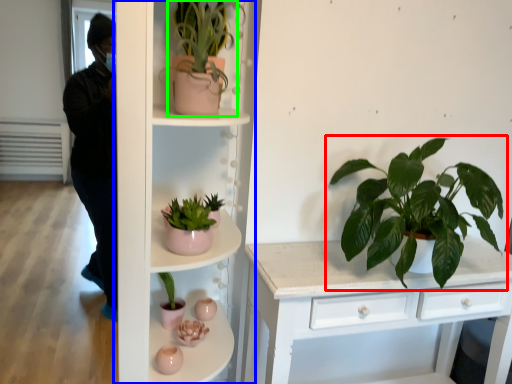
Question: Which is farther away from houseplant (highlighted by a red box)? shelf (highlighted by a blue box) or houseplant (highlighted by a green box)?

Choices:
 (A) shelf
 (B) houseplant

Answer: (B)